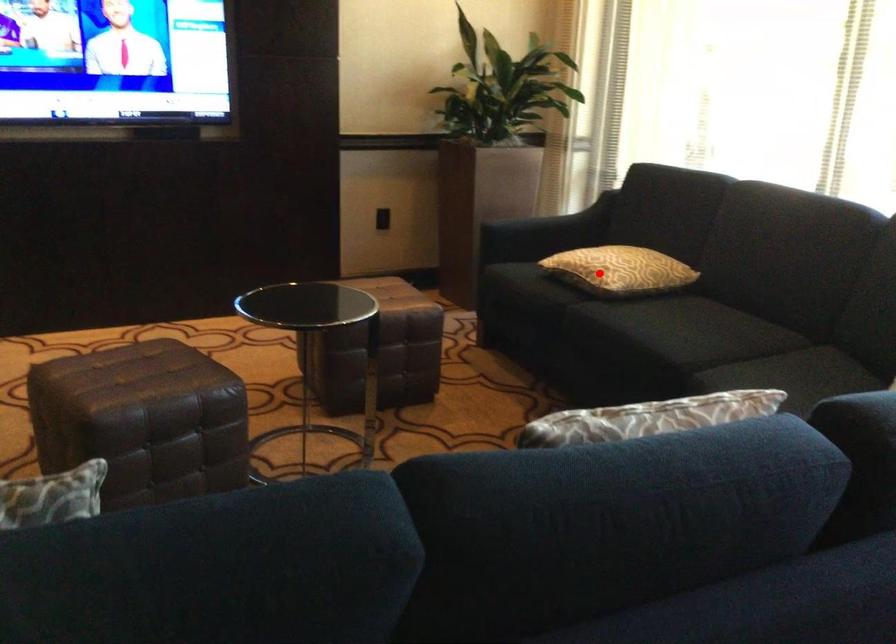
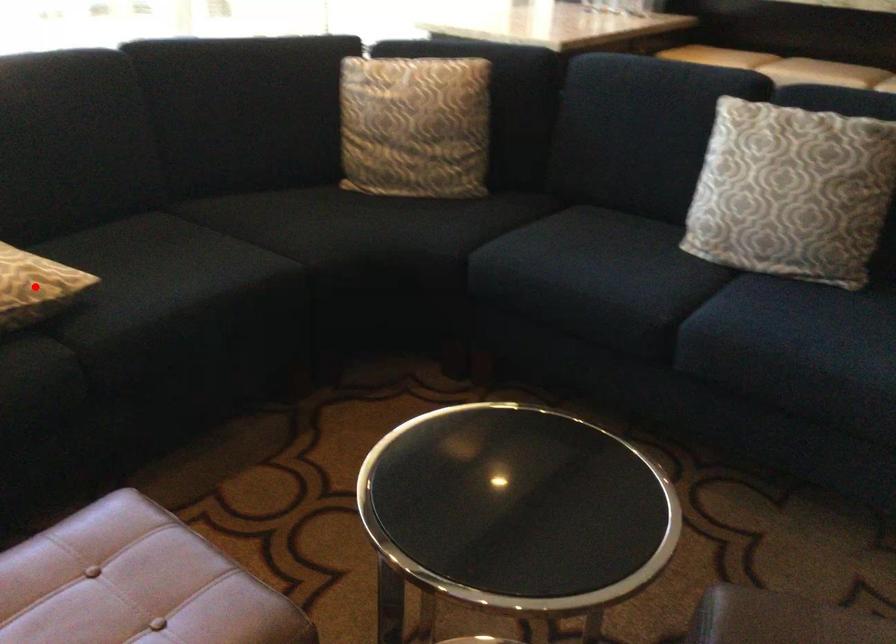
I am providing you with two images of the same scene from different viewpoints. A red point is marked on the first image and another point is marked on the second image. Are the points marked in image1 and image2 representing the same 3D position?

Yes